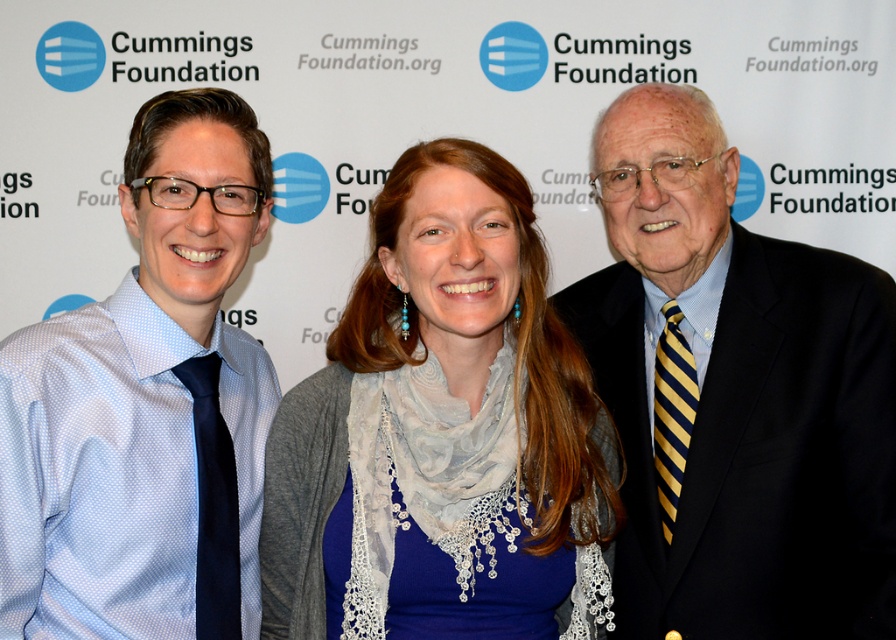
You are standing in front of the Cummings Foundation backdrop and want to place two markers at the coordinates point (746,435) and point (271,403). Which marker will appear closer to you when viewed from your current position?

The point (746,435) is closer to the camera than point (271,403), so the marker at point (746,435) will appear closer to you.

You are a photographer at the Cummings Foundation event. You need to ensure that all participants are visible in the group photo. Given that the black suit at center is larger in size than the matte blue shirt at left, which participant should you position closer to the camera to maintain visibility?

The black suit at center is larger in size than the matte blue shirt at left, so positioning the matte blue shirt at left closer to the camera will help ensure both participants are equally visible in the photo.

You are a photographer at the Cummings Foundation event. You need to adjust the lighting so that the black suit at center and the matte blue shirt at left are both well lit. However, the current setup only allows you to focus the light on one area. Which area should you prioritize to ensure both are adequately lit?

Since the black suit at center is positioned over the matte blue shirt at left, focusing the light on the black suit at center will also illuminate the matte blue shirt at left beneath it.